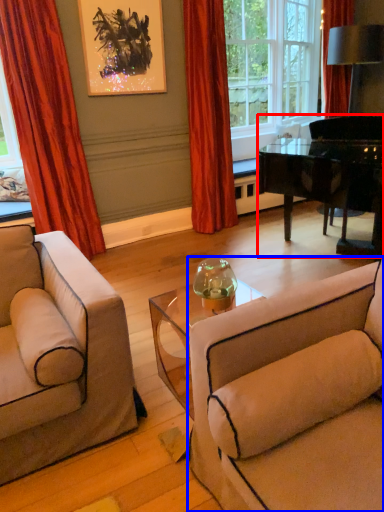
Question: Which of the following is the closest to the observer, piano (highlighted by a red box) or studio couch (highlighted by a blue box)?

Choices:
 (A) piano
 (B) studio couch

Answer: (B)